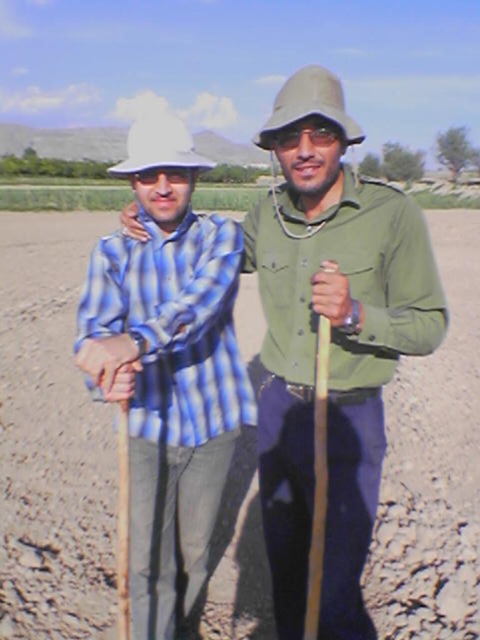
You are planning to walk along the brown dirt track at center and need to pass under the green matte pith helmet at upper center. Based on the scene, will you be able to walk under it without bending down?

The brown dirt track at center is above the green matte pith helmet at upper center, so the helmet is positioned higher up. Therefore, you can walk under it without needing to bend down.

You are a photographer trying to capture both the green matte pith helmet at upper center and the white matte hat at center in a single photo. Based on their positions, which one will appear closer to the camera in the photo?

The green matte pith helmet at upper center will appear closer to the camera because it is positioned in front of the white matte hat at center.

You are a drone operator trying to locate the blue striped shirt at left in the image. The system shows a point at coordinates (168,368). Is this point likely indicating the location of the blue striped shirt at left?

Yes, the point at coordinates (168,368) corresponds to the blue striped shirt at left, so the point is likely indicating its location.